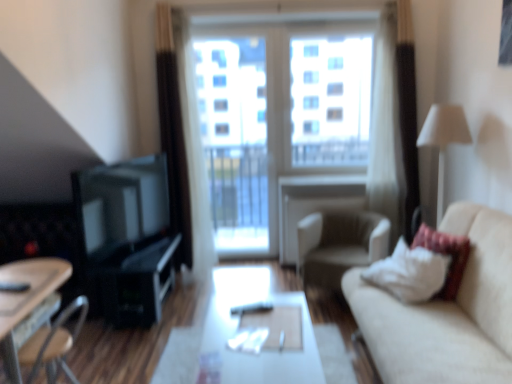
Question: Would you say matte black entertainment center at left is to the left or to the right of beige fabric couch at right in the picture?

Choices:
 (A) left
 (B) right

Answer: (A)

Question: In the image, is matte black entertainment center at left positioned in front of or behind beige fabric couch at right?

Choices:
 (A) behind
 (B) front

Answer: (A)

Question: Considering the real-world distances, which object is farthest from the beige fabric armchair at center?

Choices:
 (A) white sheer curtain at left
 (B) matte black entertainment center at left
 (C) transparent glass window at center
 (D) white fabric lampshade at right
 (E) white glossy table at center, marked as the second table in a left-to-right arrangement

Answer: (B)

Question: Which is farther from the white fabric lampshade at right?

Choices:
 (A) white soft pillow at right
 (B) white sheer curtain at left
 (C) white glossy table at center, marked as the second table in a left-to-right arrangement
 (D) transparent glass screen door at center
 (E) beige fabric armchair at center

Answer: (B)